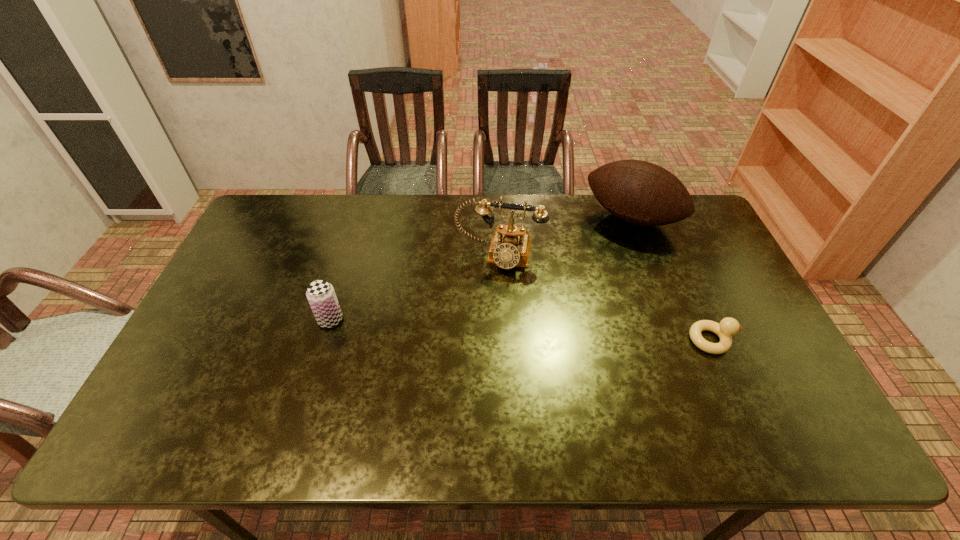
Identify the location of free space between the football and the shortest object. Image resolution: width=960 pixels, height=540 pixels. (672, 279).

Find the location of a particular element. This screenshot has width=960, height=540. vacant area between the football and the telephone is located at coordinates (565, 237).

Where is `free space between the telephone and the shortest object`? The width and height of the screenshot is (960, 540). free space between the telephone and the shortest object is located at coordinates (606, 298).

Choose which object is the nearest neighbor to the second object from left to right. Please provide its 2D coordinates. Your answer should be formatted as a tuple, i.e. [(x, y)], where the tuple contains the x and y coordinates of a point satisfying the conditions above.

[(639, 192)]

Identify which object is the nearest to the telephone. Please provide its 2D coordinates. Your answer should be formatted as a tuple, i.e. [(x, y)], where the tuple contains the x and y coordinates of a point satisfying the conditions above.

[(639, 192)]

Where is `vacant space that satisfies the following two spatial constraints: 1. on the front side of the duckling; 2. at the beak of the third object from right to left`? The width and height of the screenshot is (960, 540). vacant space that satisfies the following two spatial constraints: 1. on the front side of the duckling; 2. at the beak of the third object from right to left is located at coordinates (503, 340).

This screenshot has height=540, width=960. Find the location of `vacant space that satisfies the following two spatial constraints: 1. on the front side of the beer can; 2. at the beak of the duckling`. vacant space that satisfies the following two spatial constraints: 1. on the front side of the beer can; 2. at the beak of the duckling is located at coordinates (324, 340).